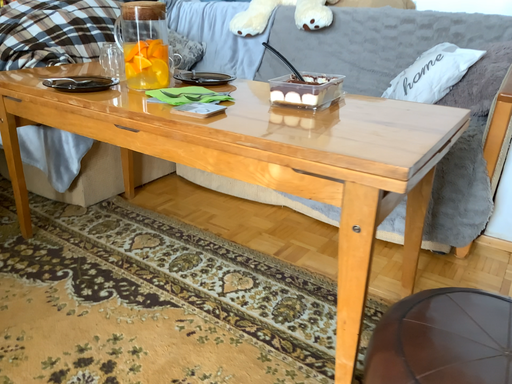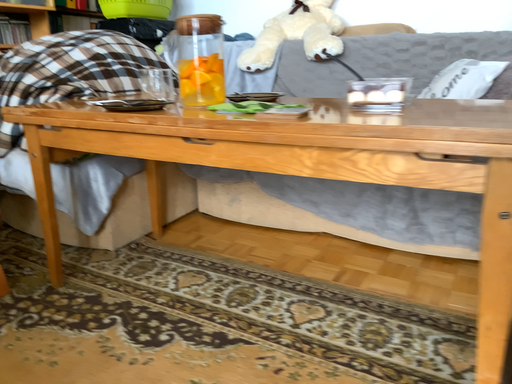
Question: Which way did the camera rotate in the video?

Choices:
 (A) rotated downward
 (B) rotated upward

Answer: (B)